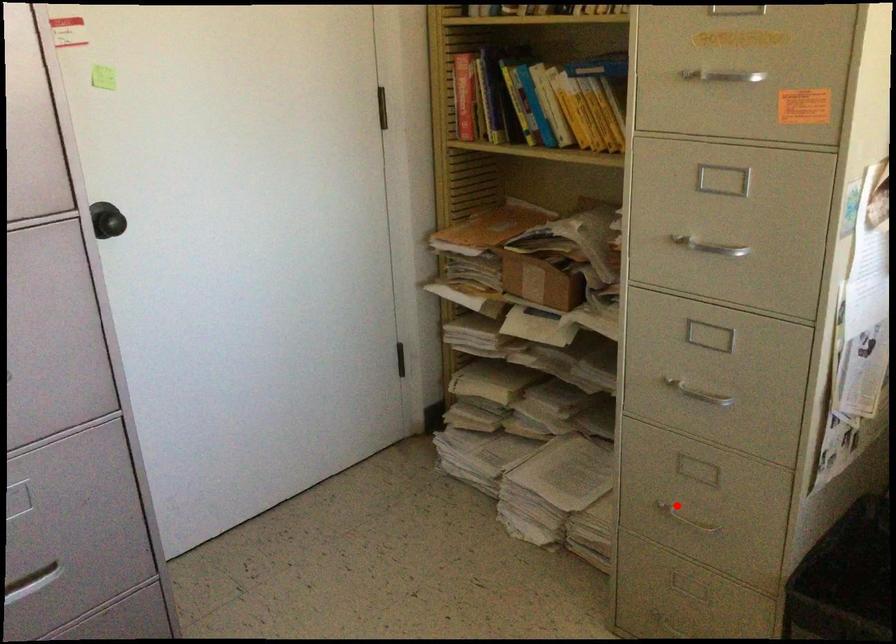
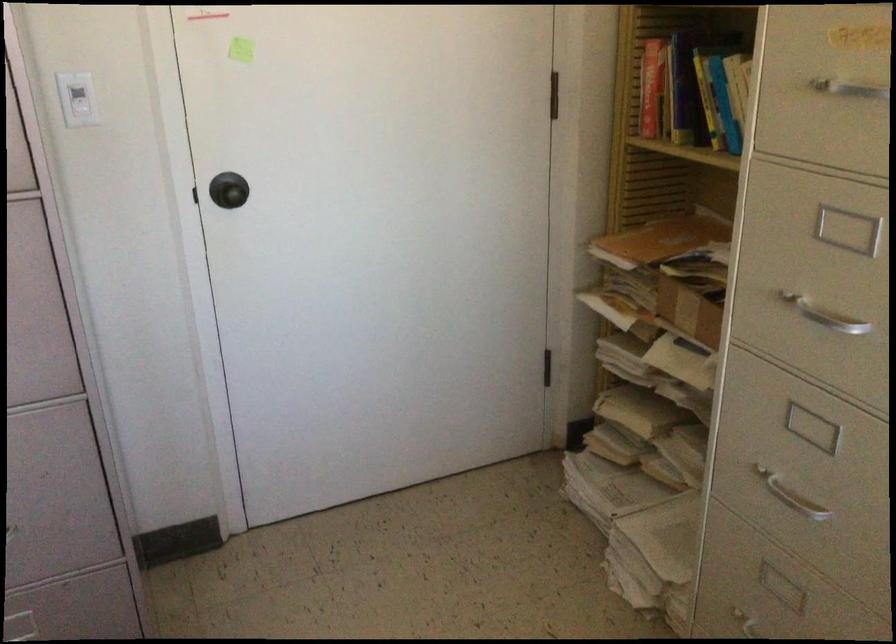
Question: I am providing you with two images of the same scene from different viewpoints. Given a red point in image1, look at the same physical point in image2. Is it:

Choices:
 (A) Closer to the viewpoint
 (B) Farther from the viewpoint

Answer: (A)